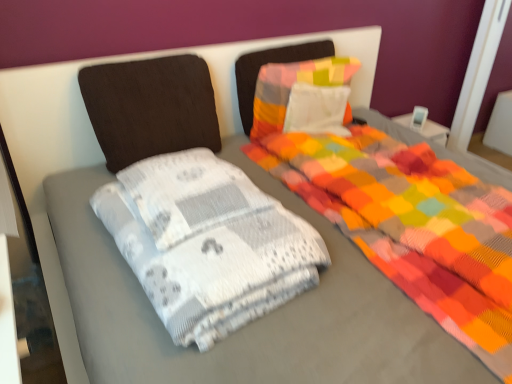
Question: Could you tell me if white textured blanket at center is turned towards multicolored fabric pillow at center, the 1th pillow in the right-to-left sequence?

Choices:
 (A) yes
 (B) no

Answer: (B)

Question: Does white textured blanket at center come behind multicolored fabric pillow at center, the 1th pillow in the right-to-left sequence?

Choices:
 (A) no
 (B) yes

Answer: (A)

Question: From a real-world perspective, is white textured blanket at center below multicolored fabric pillow at center, the 1th pillow in the right-to-left sequence?

Choices:
 (A) yes
 (B) no

Answer: (A)

Question: Can you confirm if white textured blanket at center is smaller than multicolored fabric pillow at center, the 1th pillow in the right-to-left sequence?

Choices:
 (A) yes
 (B) no

Answer: (B)

Question: Is white textured blanket at center wider than multicolored fabric pillow at center, the 1th pillow in the right-to-left sequence?

Choices:
 (A) yes
 (B) no

Answer: (A)

Question: From the image's perspective, is white textured blanket at center on top of multicolored fabric pillow at center, the 2th pillow from the left?

Choices:
 (A) no
 (B) yes

Answer: (A)

Question: Is dark brown fabric pillow at upper left, placed as the 1th pillow when sorted from left to right, smaller than multicolored fabric pillow at center, the 1th pillow in the right-to-left sequence?

Choices:
 (A) no
 (B) yes

Answer: (A)

Question: Would you consider dark brown fabric pillow at upper left, placed as the 1th pillow when sorted from left to right, to be distant from multicolored fabric pillow at center, the 1th pillow in the right-to-left sequence?

Choices:
 (A) no
 (B) yes

Answer: (A)

Question: From a real-world perspective, is dark brown fabric pillow at upper left, placed as the 1th pillow when sorted from left to right, on top of multicolored fabric pillow at center, the 1th pillow in the right-to-left sequence?

Choices:
 (A) no
 (B) yes

Answer: (B)

Question: Is dark brown fabric pillow at upper left, placed as the 1th pillow when sorted from left to right, turned away from multicolored fabric pillow at center, the 1th pillow in the right-to-left sequence?

Choices:
 (A) no
 (B) yes

Answer: (A)

Question: Considering the relative sizes of dark brown fabric pillow at upper left, which is the second pillow from right to left, and multicolored fabric pillow at center, the 2th pillow from the left, in the image provided, is dark brown fabric pillow at upper left, which is the second pillow from right to left, taller than multicolored fabric pillow at center, the 2th pillow from the left,?

Choices:
 (A) no
 (B) yes

Answer: (B)

Question: Is dark brown fabric pillow at upper left, placed as the 1th pillow when sorted from left to right, further to the viewer compared to multicolored fabric pillow at center, the 1th pillow in the right-to-left sequence?

Choices:
 (A) no
 (B) yes

Answer: (A)

Question: Can you confirm if dark brown fabric pillow at upper left, placed as the 1th pillow when sorted from left to right, is taller than white textured blanket at center?

Choices:
 (A) no
 (B) yes

Answer: (B)